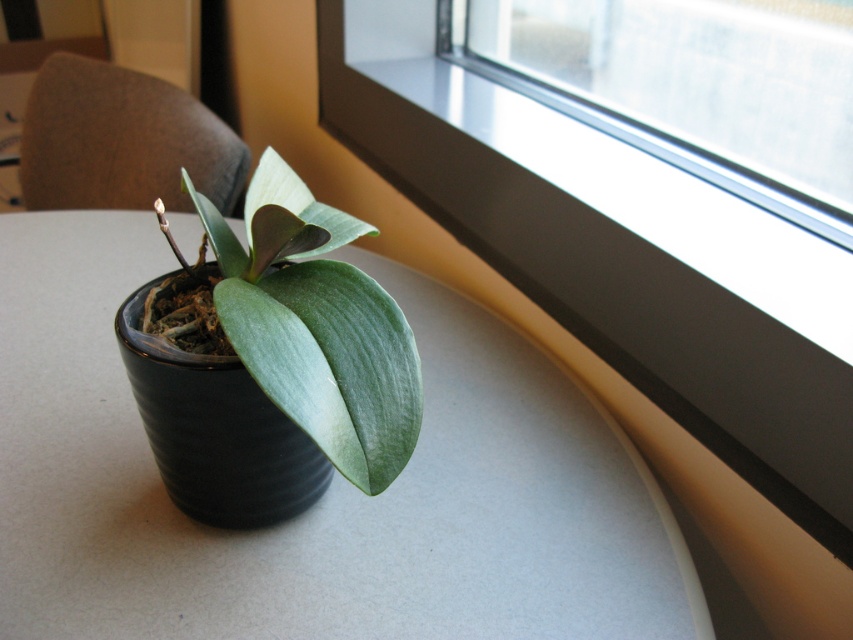
Question: Which object is positioned closest to the green matte leaf at center?

Choices:
 (A) transparent glass at upper right
 (B) matte black pot at center
 (C) black ceramic vase at center

Answer: (C)

Question: Does matte black pot at center have a greater width compared to transparent glass at upper right?

Choices:
 (A) yes
 (B) no

Answer: (A)

Question: Considering the relative positions of transparent glass at upper right and black ceramic vase at center in the image provided, where is transparent glass at upper right located with respect to black ceramic vase at center?

Choices:
 (A) above
 (B) below

Answer: (A)

Question: Among these points, which one is nearest to the camera?

Choices:
 (A) (717, 45)
 (B) (221, 371)
 (C) (305, 232)
 (D) (177, 592)

Answer: (C)

Question: Does green matte leaf at center have a lesser width compared to black ceramic vase at center?

Choices:
 (A) yes
 (B) no

Answer: (B)

Question: Which object appears farthest from the camera in this image?

Choices:
 (A) matte black pot at center
 (B) green matte leaf at center

Answer: (A)